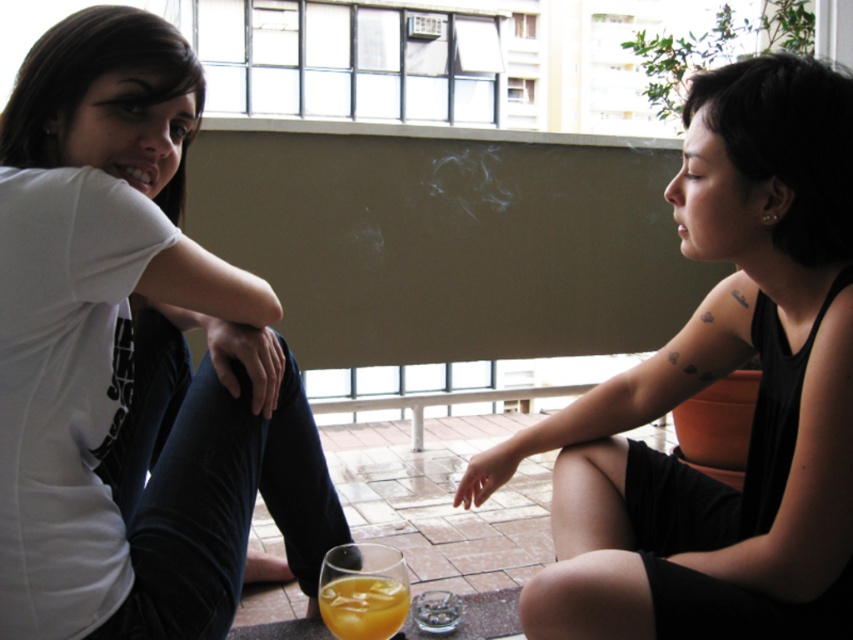
Which is more to the left, black matte tank top at center or white matte t-shirt at upper left?

Positioned to the left is white matte t-shirt at upper left.

I want to click on black matte tank top at center, so click(x=711, y=381).

Image resolution: width=853 pixels, height=640 pixels. In order to click on black matte tank top at center in this screenshot , I will do `click(711, 381)`.

In the scene shown: Between black matte tank top at center and translucent glass of orange juice at lower center, which one appears on the left side from the viewer's perspective?

Positioned to the left is translucent glass of orange juice at lower center.

Who is more distant from viewer, (672,609) or (361,584)?

Point (672,609)

Is point (844, 451) behind point (403, 600)?

That is True.

Locate an element on the screen. The image size is (853, 640). black matte tank top at center is located at coordinates (711, 381).

Does white matte t-shirt at upper left appear on the right side of translucent glass of orange juice at lower center?

In fact, white matte t-shirt at upper left is to the left of translucent glass of orange juice at lower center.

What do you see at coordinates (93, 310) in the screenshot?
I see `white matte t-shirt at upper left` at bounding box center [93, 310].

Is point (196, 376) less distant than point (397, 609)?

That is False.

Find the location of a particular element. white matte t-shirt at upper left is located at coordinates (93, 310).